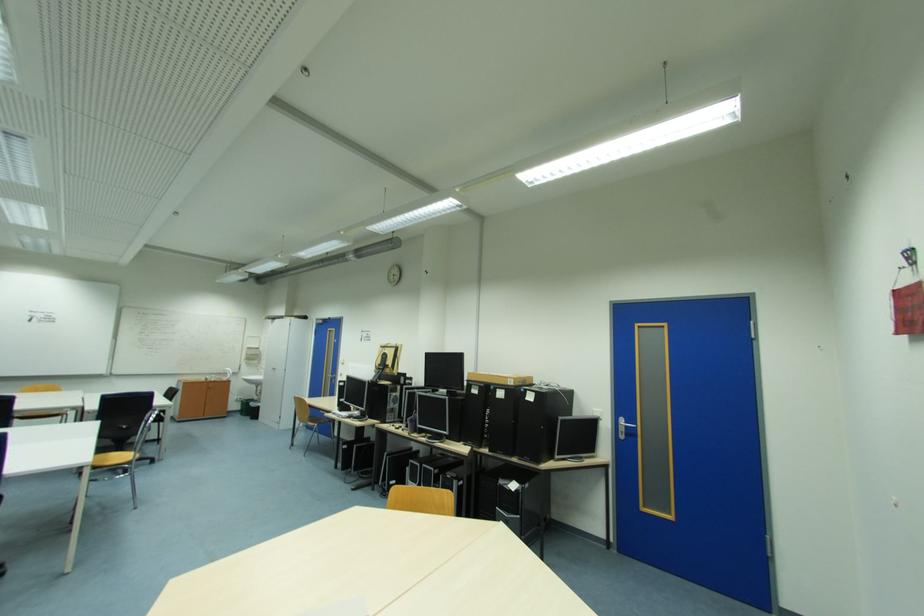
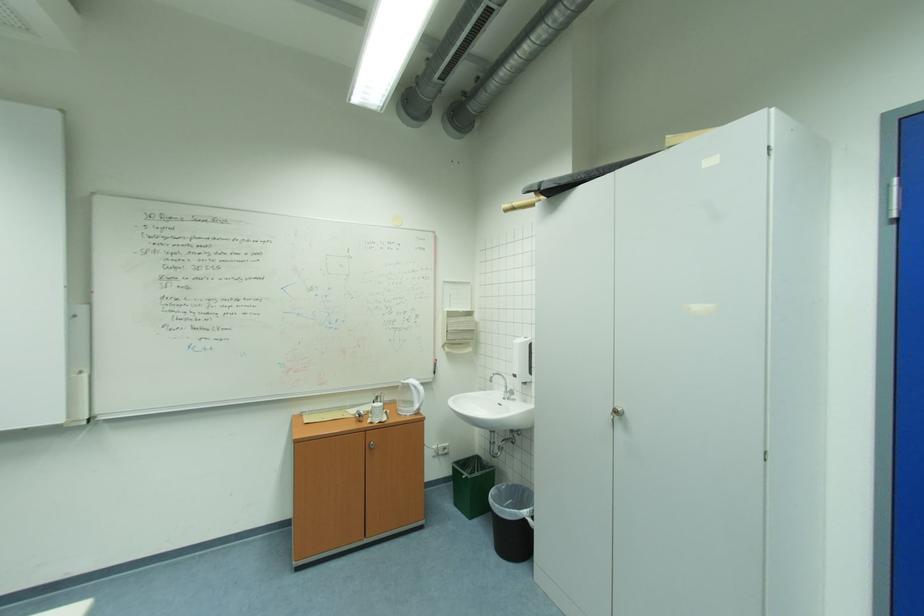
Where in the second image is the point corresponding to pixel 266 405 from the first image?

(532, 513)